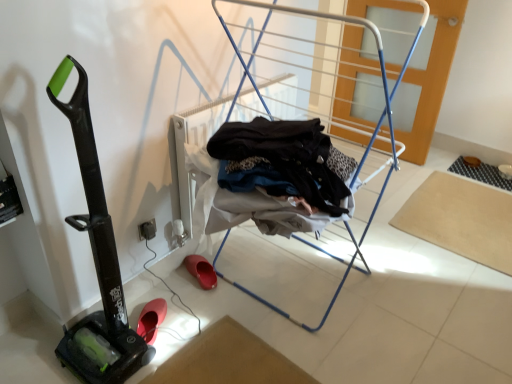
The image size is (512, 384). I want to click on unoccupied space behind rubber/matte clog at lower left, the 1th footwear from the back, so click(x=224, y=249).